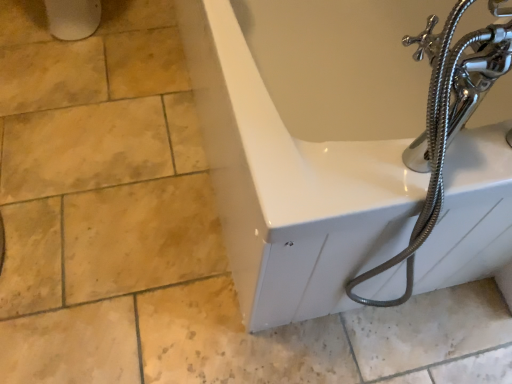
Question: Considering the relative positions of white glossy bathtub at upper right and metallic silver garden hose at right in the image provided, is white glossy bathtub at upper right to the left or to the right of metallic silver garden hose at right?

Choices:
 (A) right
 (B) left

Answer: (B)

Question: From the image's perspective, is white glossy bathtub at upper right positioned above or below metallic silver garden hose at right?

Choices:
 (A) above
 (B) below

Answer: (A)

Question: Is white glossy bathtub at upper right inside the boundaries of metallic silver garden hose at right, or outside?

Choices:
 (A) outside
 (B) inside

Answer: (A)

Question: Does point (496, 77) appear closer or farther from the camera than point (189, 41)?

Choices:
 (A) closer
 (B) farther

Answer: (A)

Question: From the image's perspective, is metallic silver garden hose at right above or below white glossy bathtub at upper right?

Choices:
 (A) below
 (B) above

Answer: (A)

Question: Considering the positions of metallic silver garden hose at right and white glossy bathtub at upper right in the image, is metallic silver garden hose at right bigger or smaller than white glossy bathtub at upper right?

Choices:
 (A) big
 (B) small

Answer: (B)

Question: In terms of width, does metallic silver garden hose at right look wider or thinner when compared to white glossy bathtub at upper right?

Choices:
 (A) thin
 (B) wide

Answer: (A)